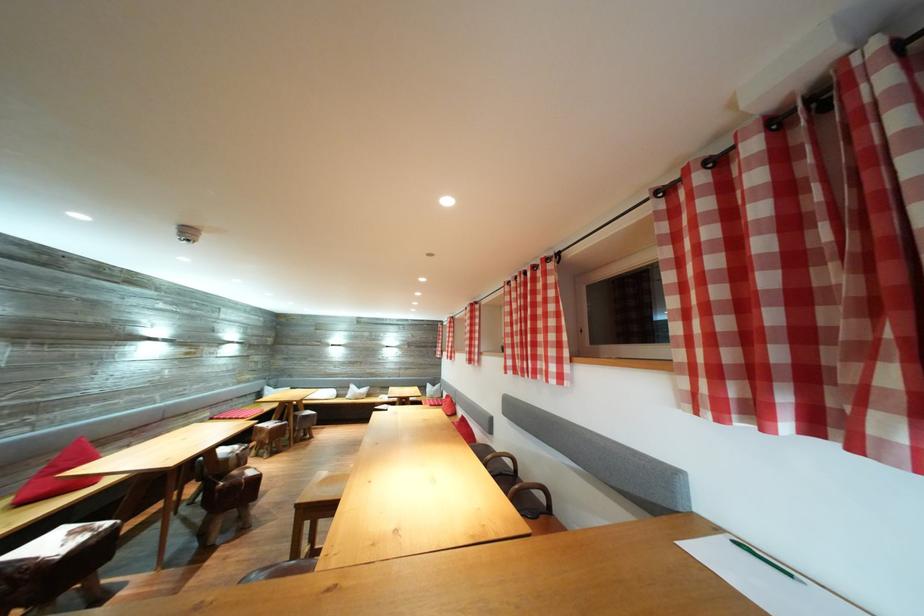
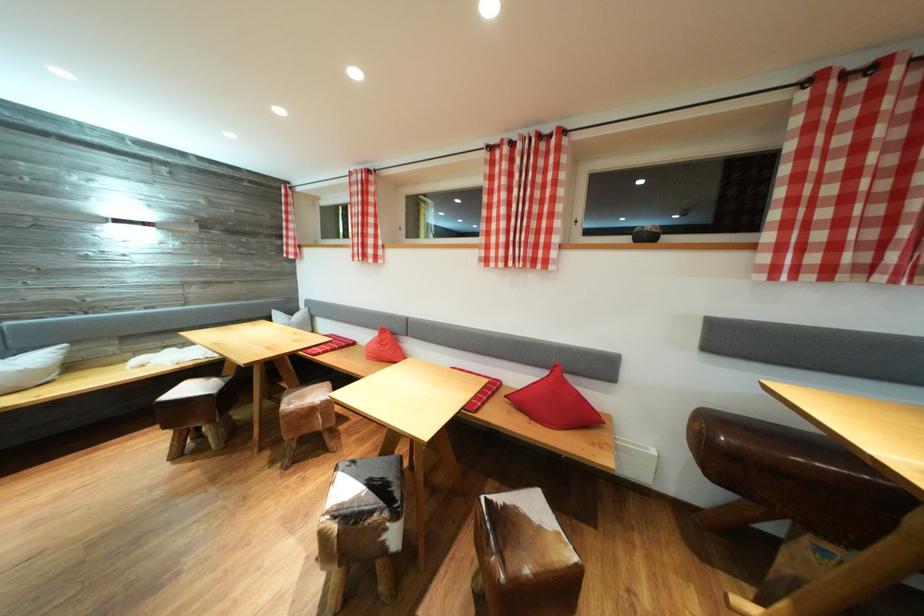
Find the pixel in the second image that matches (x=454, y=402) in the first image.

(390, 336)